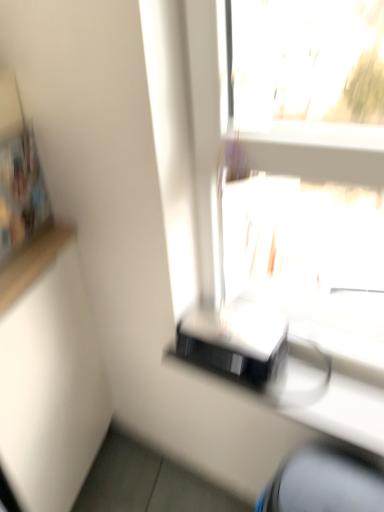
Locate an element on the screen. This screenshot has width=384, height=512. free space above blue fabric computer chair at lower right (from a real-world perspective) is located at coordinates point(327,485).